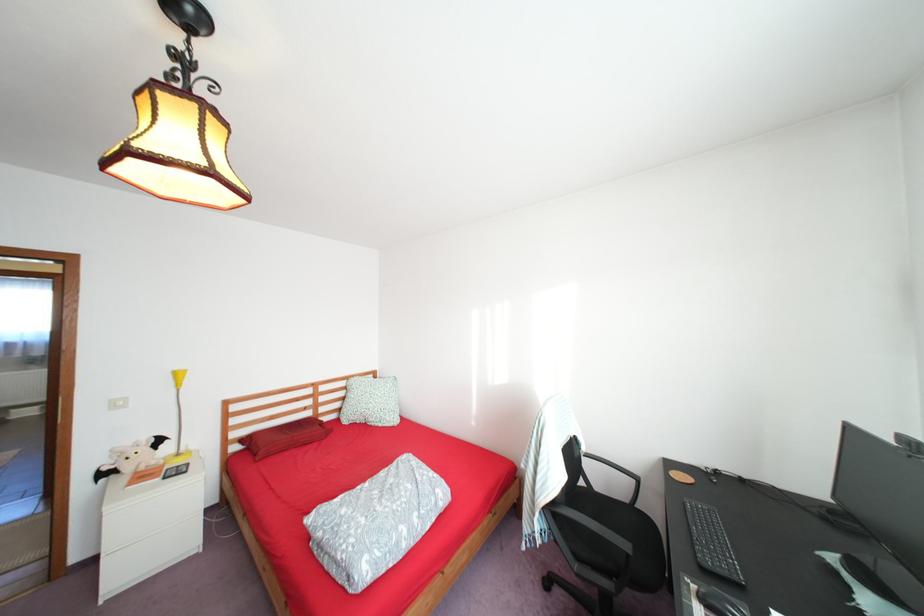
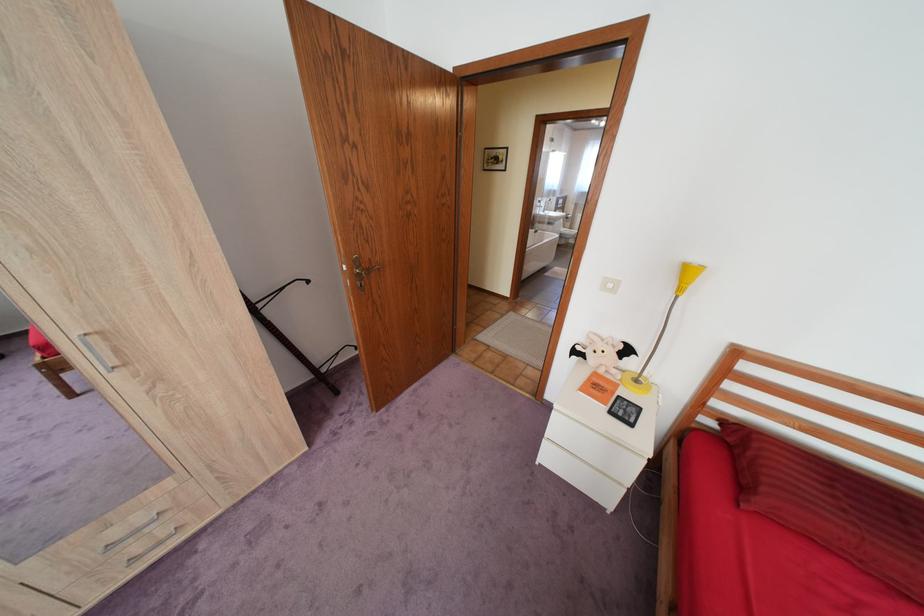
Locate, in the second image, the point that corresponds to [152,476] in the first image.

(606, 386)